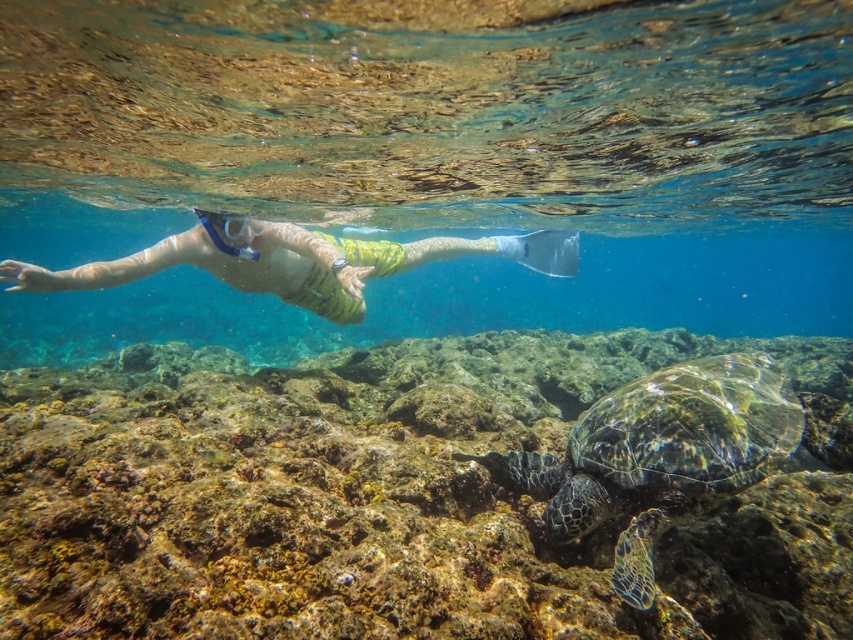
Between green textured shell at center and transparent rubber snorkel at center, which one has less height?

Standing shorter between the two is transparent rubber snorkel at center.

Describe the element at coordinates (660, 454) in the screenshot. I see `green textured shell at center` at that location.

This screenshot has height=640, width=853. I want to click on green textured shell at center, so 660,454.

Who is taller, green rough coral reef at center or green textured shell at center?

Standing taller between the two is green rough coral reef at center.

Does green rough coral reef at center lie in front of green textured shell at center?

Yes.

Measure the distance between point (57, 381) and camera.

Point (57, 381) and camera are 28.38 feet apart.

The height and width of the screenshot is (640, 853). Identify the location of green rough coral reef at center. (387, 497).

The image size is (853, 640). I want to click on green textured shell at center, so click(x=660, y=454).

Who is more forward, (663, 406) or (283, 298)?

Positioned in front is point (663, 406).

Between point (764, 465) and point (555, 256), which one is positioned in front?

Positioned in front is point (764, 465).

Where is `green textured shell at center`? The width and height of the screenshot is (853, 640). green textured shell at center is located at coordinates (660, 454).